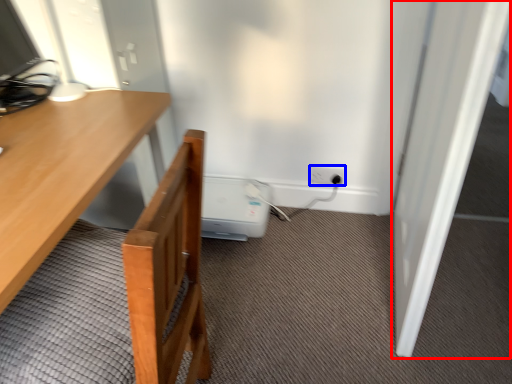
Question: Which point is further to the camera, door (highlighted by a red box) or electric outlet (highlighted by a blue box)?

Choices:
 (A) door
 (B) electric outlet

Answer: (B)